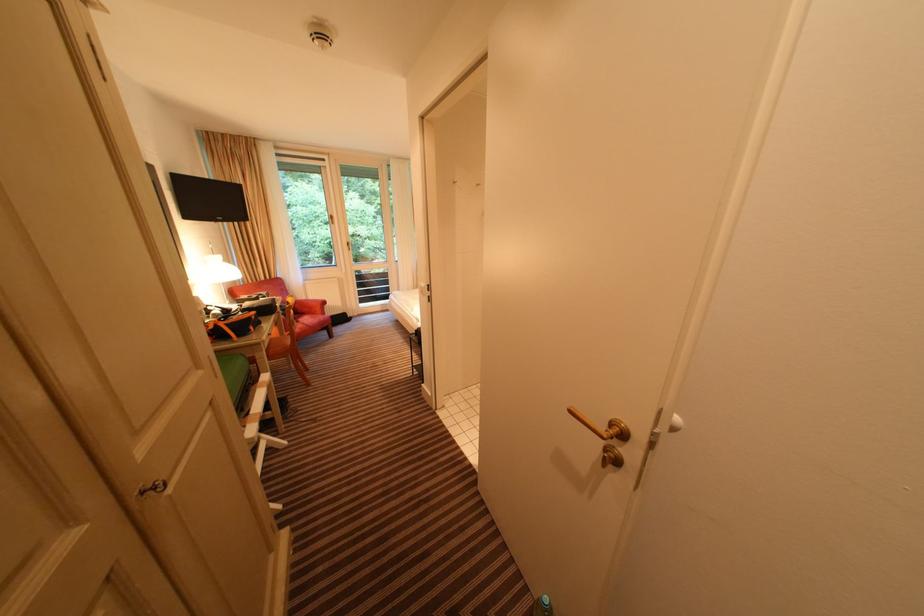
You are a GUI agent. You are given a task and a screenshot of the screen. Output one action in this format:
    pyautogui.click(x=<x>, y=<y>)
    Task: Click on the gold door lock
    
    Given the screenshot: What is the action you would take?
    pyautogui.click(x=611, y=456)